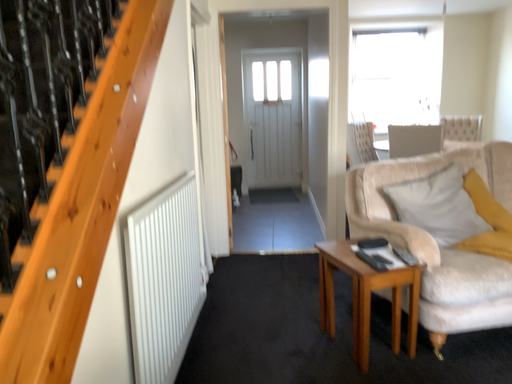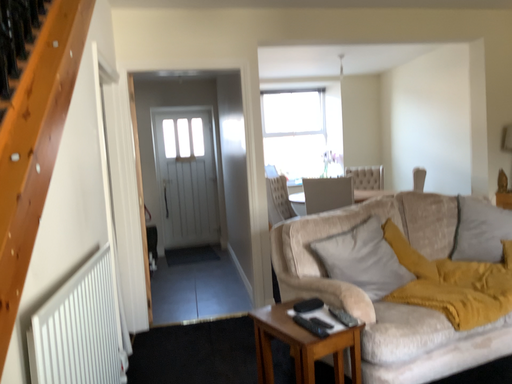
Question: Which way did the camera rotate in the video?

Choices:
 (A) rotated right
 (B) rotated left

Answer: (A)